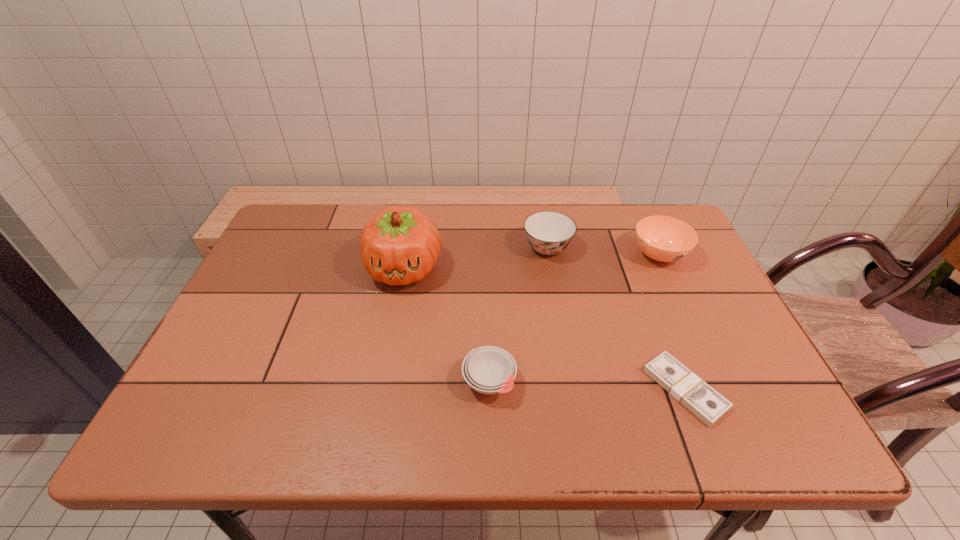
Find the location of a particular element. pumpkin is located at coordinates (400, 245).

The image size is (960, 540). Find the location of `the tallest object`. the tallest object is located at coordinates (400, 245).

This screenshot has width=960, height=540. Find the location of `the second soup bowl from left to right`. the second soup bowl from left to right is located at coordinates (548, 232).

Find the location of a particular element. the rightmost soup bowl is located at coordinates (665, 239).

Identify the location of the nearest soup bowl. (489, 370).

This screenshot has width=960, height=540. Find the location of `the fourth tallest object`. the fourth tallest object is located at coordinates (489, 370).

Where is `the shortest object`? The width and height of the screenshot is (960, 540). the shortest object is located at coordinates (703, 401).

Where is `vacant space located 0.400m on the side of the pumpkin with the cute face`? vacant space located 0.400m on the side of the pumpkin with the cute face is located at coordinates (372, 441).

Where is `vacant area located on the left of the third object from left to right`? This screenshot has height=540, width=960. vacant area located on the left of the third object from left to right is located at coordinates (488, 248).

Identify the location of vacant position located 0.250m on the front of the rightmost soup bowl. (701, 346).